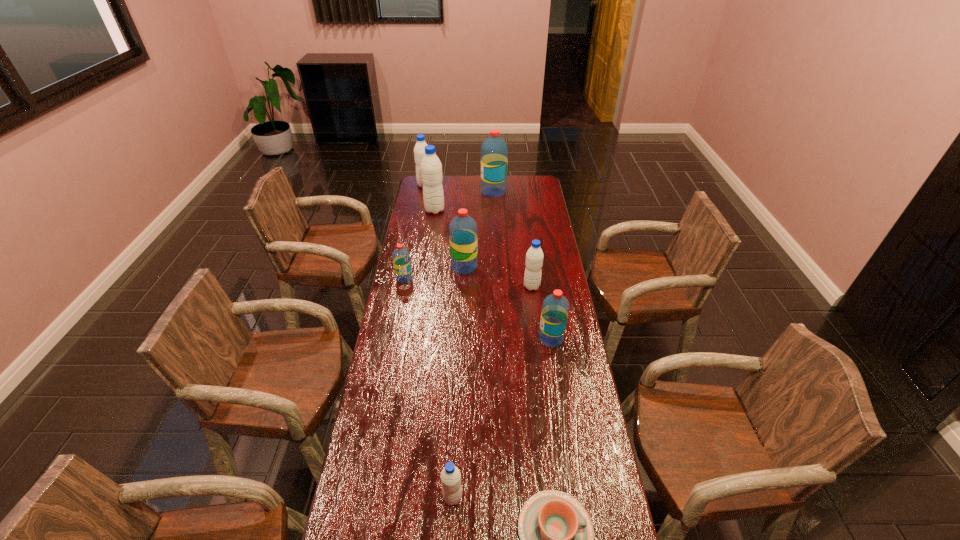
Find the location of `vacant space located on the front label of the second nearest water bottle`. vacant space located on the front label of the second nearest water bottle is located at coordinates tap(444, 339).

The width and height of the screenshot is (960, 540). I want to click on vacant area situated on the front label of the second nearest water bottle, so click(x=489, y=339).

This screenshot has height=540, width=960. Find the location of `blank space located 0.270m on the front label of the second nearest water bottle`. blank space located 0.270m on the front label of the second nearest water bottle is located at coordinates (468, 339).

This screenshot has width=960, height=540. Identify the location of free spot located 0.290m on the front label of the smallest red water bottle. [x=394, y=334].

The height and width of the screenshot is (540, 960). I want to click on free space located 0.390m on the right of the smallest gray water bottle, so click(601, 497).

The width and height of the screenshot is (960, 540). In order to click on object situated at the far left corner in this screenshot , I will do `click(419, 150)`.

Find the location of a particular element. This screenshot has height=540, width=960. free space at the far edge of the desktop is located at coordinates (507, 194).

Locate an element on the screen. The height and width of the screenshot is (540, 960). vacant space at the left edge of the desktop is located at coordinates (418, 211).

In the image, there is a desktop. Identify the location of vacant space at the right edge. Image resolution: width=960 pixels, height=540 pixels. click(544, 355).

Identify the location of vacant space at the far right corner of the desktop. (530, 184).